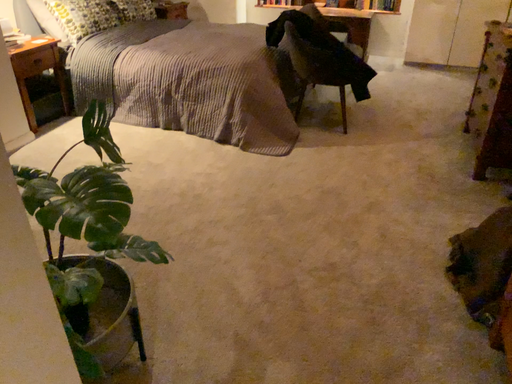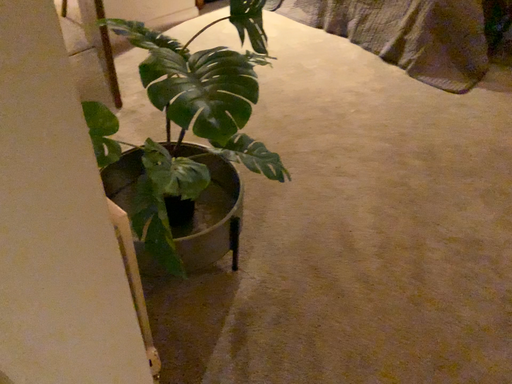
Question: Which way did the camera rotate in the video?

Choices:
 (A) rotated left
 (B) rotated right

Answer: (A)